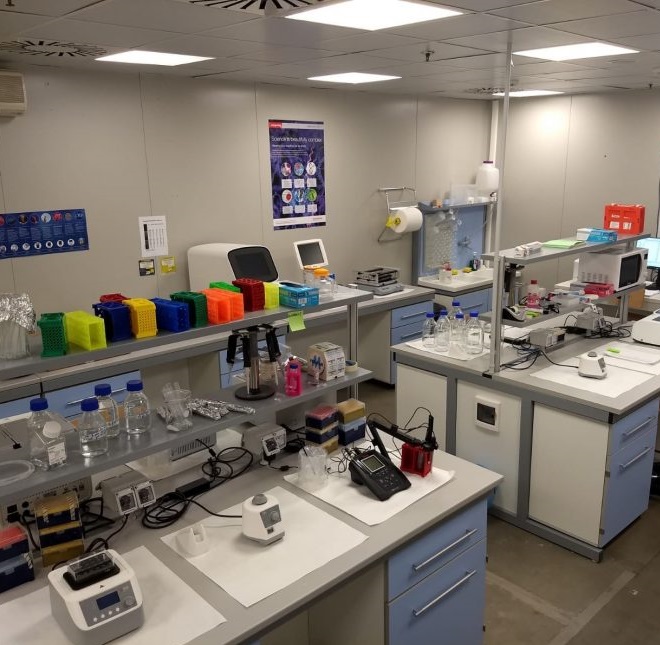
This screenshot has width=660, height=645. Find the location of `black cords`. black cords is located at coordinates (198, 482), (546, 361), (602, 335).